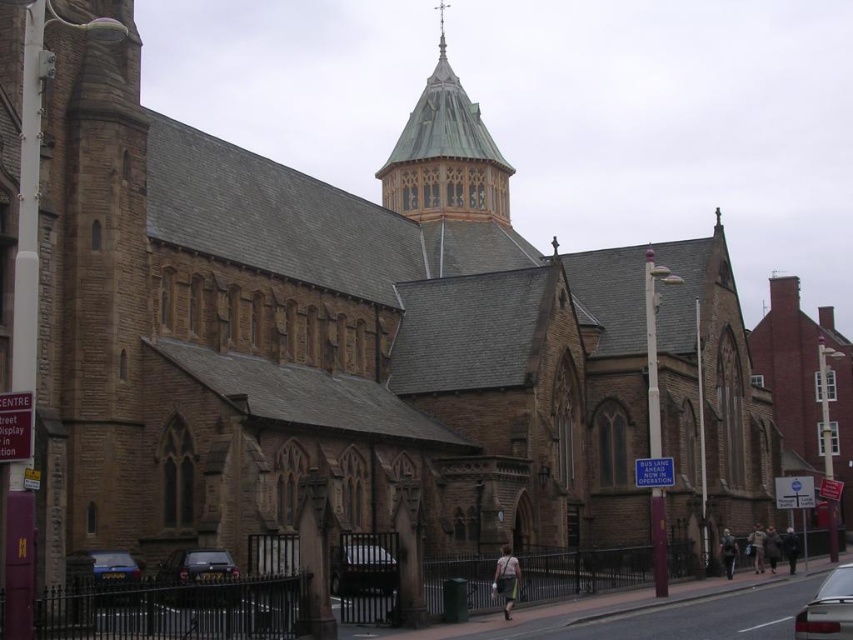
Question: Considering the relative positions of metallic silver car at center and metallic silver car at lower left in the image provided, where is metallic silver car at center located with respect to metallic silver car at lower left?

Choices:
 (A) above
 (B) below

Answer: (B)

Question: Which object is farther from the camera taking this photo?

Choices:
 (A) green copper roof at upper center
 (B) metallic silver car at lower left
 (C) dark gray metallic car at lower left

Answer: (A)

Question: Which is nearer to the dark gray metallic car at lower left?

Choices:
 (A) metallic silver car at lower right
 (B) red brick church at right

Answer: (A)

Question: Estimate the real-world distances between objects in this image. Which object is farther from the metallic silver car at center?

Choices:
 (A) dark gray metallic car at lower left
 (B) red brick church at right
 (C) metallic silver car at lower right

Answer: (B)

Question: Can you confirm if green copper roof at upper center is positioned to the right of dark gray metallic car at lower left?

Choices:
 (A) no
 (B) yes

Answer: (B)

Question: Is red brick church at right above metallic silver car at center?

Choices:
 (A) yes
 (B) no

Answer: (A)